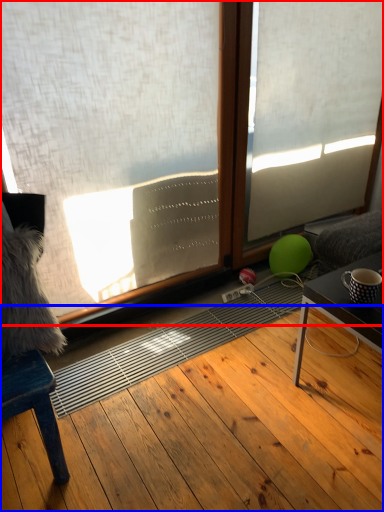
Question: Which of the following is the farthest to the observer, window (highlighted by a red box) or hardwood (highlighted by a blue box)?

Choices:
 (A) window
 (B) hardwood

Answer: (A)